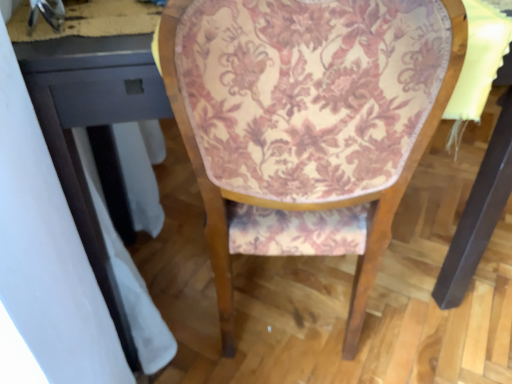
Where is `floral fabric chair at center`? floral fabric chair at center is located at coordinates (307, 123).

The image size is (512, 384). What do you see at coordinates (307, 123) in the screenshot?
I see `floral fabric chair at center` at bounding box center [307, 123].

Locate an element on the screen. The height and width of the screenshot is (384, 512). floral fabric chair at center is located at coordinates (307, 123).